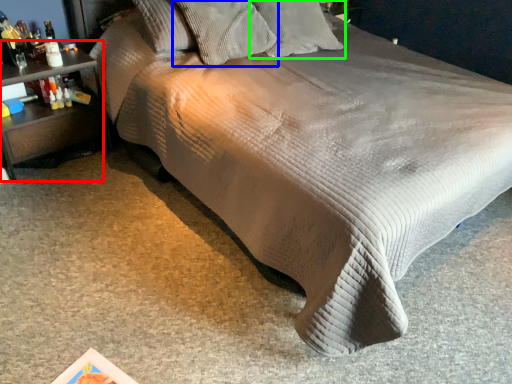
Question: Based on their relative distances, which object is nearer to nightstand (highlighted by a red box)? Choose from pillow (highlighted by a blue box) and pillow (highlighted by a green box).

Choices:
 (A) pillow
 (B) pillow

Answer: (A)